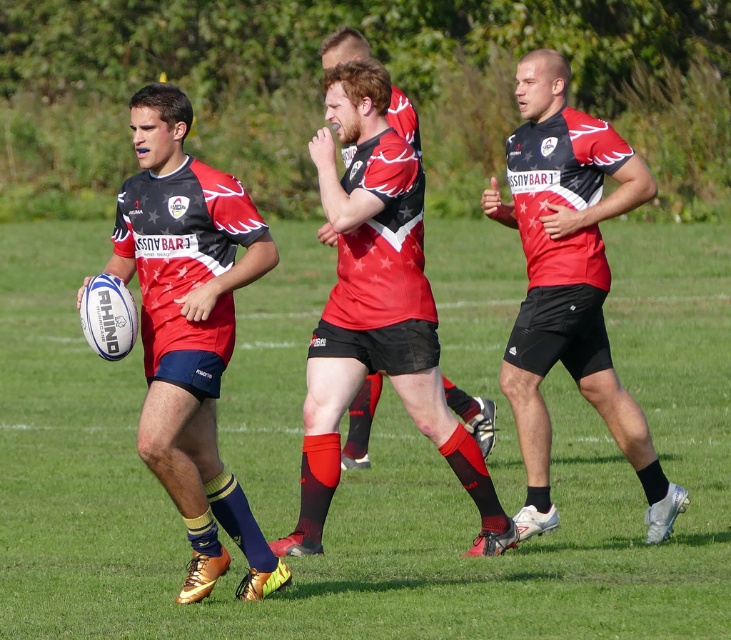
You are a photographer trying to capture the rugby player wearing the matte black shorts at center. Where should you aim your camera to get the best shot?

You should aim your camera at point (568, 282) to capture the matte black shorts at center.

You are a referee at the rugby match and need to determine if the matte black rugby ball at left can fit inside the matte red jersey at center. Based on their sizes, what is your conclusion?

The matte black rugby ball at left is larger in width than the matte red jersey at center, so the ball cannot fit inside the jersey.

You are a photographer standing at the edge of the rugby field. You want to take a photo that includes both the point at coordinates point (200, 545) and point (474, 403). Which point should you focus on first to ensure both are in focus?

You should focus on point (200, 545) first because it is closer to the viewer, so adjusting focus from near to far will help ensure both points are in focus.